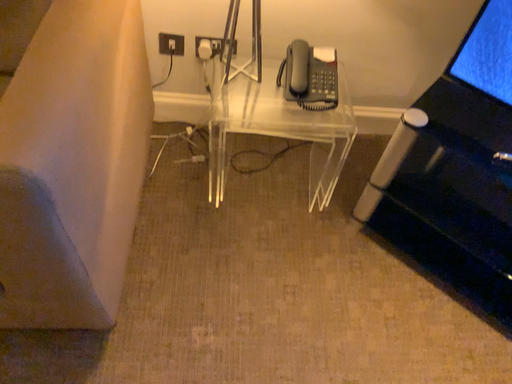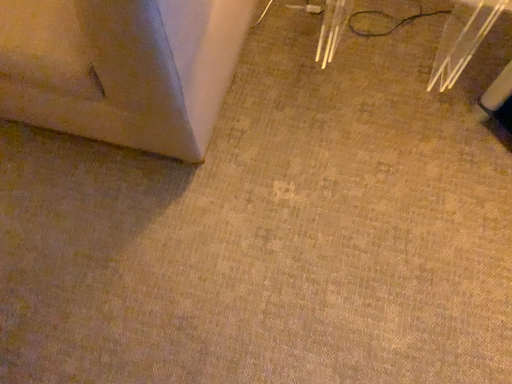
Question: How did the camera likely rotate when shooting the video?

Choices:
 (A) rotated right
 (B) rotated left

Answer: (B)